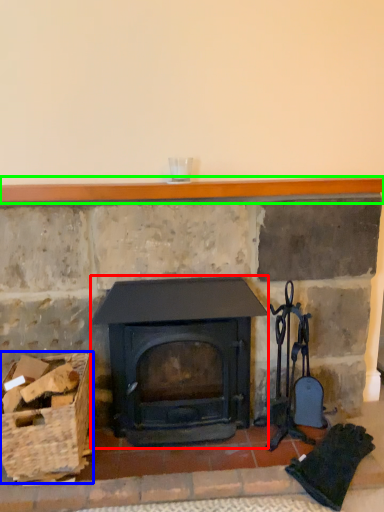
Question: Which is nearer to the wood burning stove (highlighted by a red box)? basket (highlighted by a blue box) or balustrade (highlighted by a green box).

Choices:
 (A) basket
 (B) balustrade

Answer: (A)